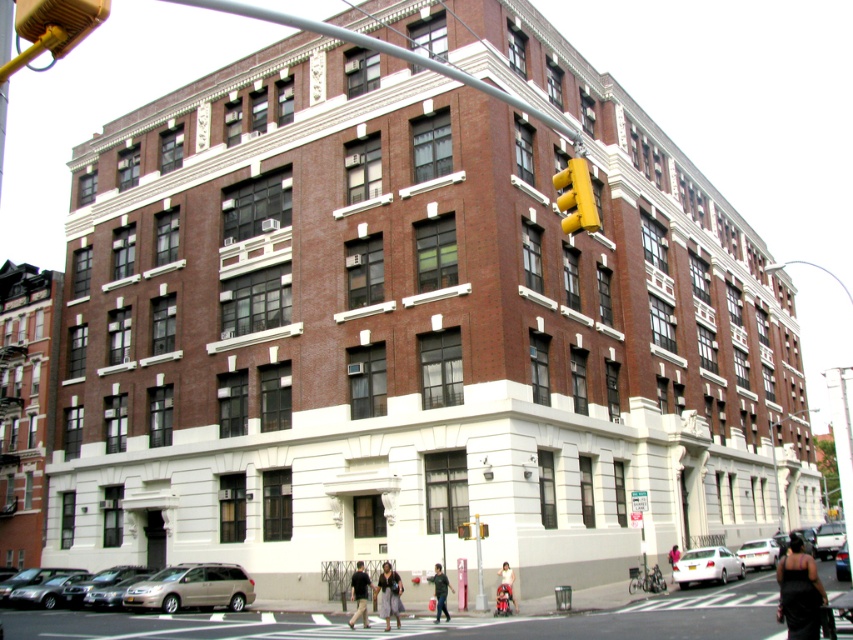
Question: Does white glossy sedan at lower right lie behind yellow plastic traffic light at upper center?

Choices:
 (A) no
 (B) yes

Answer: (B)

Question: Which of the following is the closest to the observer?

Choices:
 (A) (746, 556)
 (B) (486, 525)
 (C) (635, 506)
 (D) (689, 563)

Answer: (B)

Question: Which object is positioned closest to the white matte car at lower right?

Choices:
 (A) metallic silver minivan at lower center
 (B) white glossy sedan at lower right

Answer: (B)

Question: Which of the following is the closest to the observer?

Choices:
 (A) metallic silver minivan at lower center
 (B) white plastic street sign at upper center

Answer: (A)

Question: Does metallic silver minivan at lower center have a larger size compared to white matte car at lower right?

Choices:
 (A) yes
 (B) no

Answer: (B)

Question: Is yellow matte traffic light at upper center below yellow plastic traffic light at center?

Choices:
 (A) yes
 (B) no

Answer: (B)